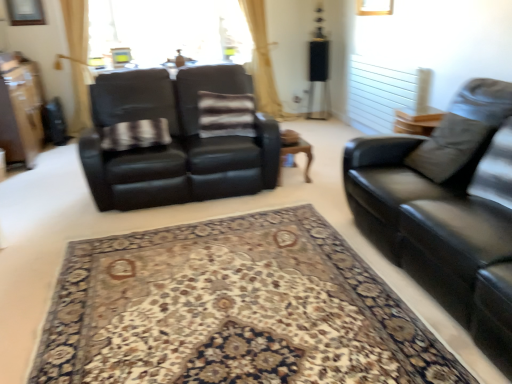
Locate an element on the screen. The image size is (512, 384). vacant space in wooden coffee table at center (from a real-world perspective) is located at coordinates (291, 169).